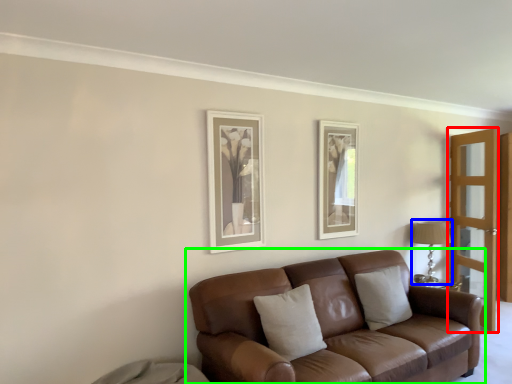
Question: Estimate the real-world distances between objects in this image. Which object is closer to screen door (highlighted by a red box), table lamp (highlighted by a blue box) or studio couch (highlighted by a green box)?

Choices:
 (A) table lamp
 (B) studio couch

Answer: (A)